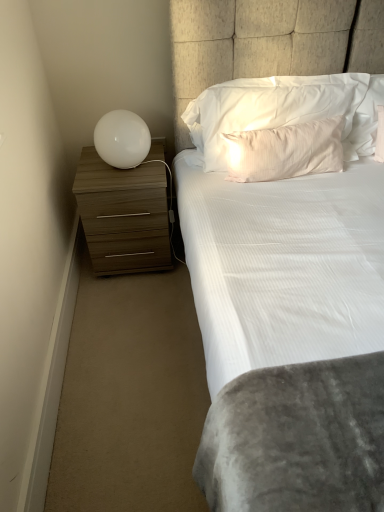
Image resolution: width=384 pixels, height=512 pixels. In order to click on vacant space situated on the left part of white glossy sphere at left in this screenshot , I will do (87, 170).